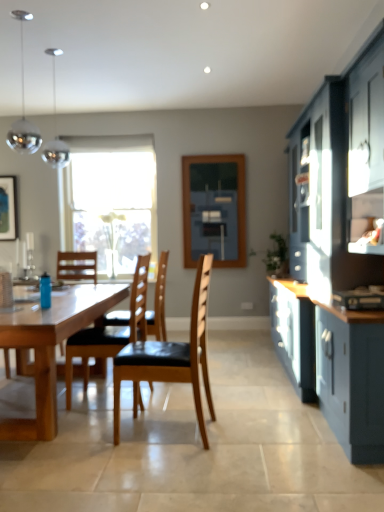
Question: From the image's perspective, relative to satin chrome pendant lights at upper left, is transparent glass window at center above or below?

Choices:
 (A) above
 (B) below

Answer: (B)

Question: From a real-world perspective, relative to satin chrome pendant lights at upper left, is transparent glass window at center vertically above or below?

Choices:
 (A) below
 (B) above

Answer: (A)

Question: Which object is positioned farthest from the wooden chair with black seat cushion at center, acting as the 2th chair starting from the front?

Choices:
 (A) brown leather chair at center, which is the first chair in front-to-back order
 (B) blue matte water bottle at table left
 (C) transparent glass window at center
 (D) wooden chair with black seat cushion at center, the 1th chair from the back
 (E) white plastic power outlet at center

Answer: (E)

Question: Which is nearer to the natural wood table at center?

Choices:
 (A) blue matte water bottle at table left
 (B) blue matte window screen at center
 (C) brown leather chair at center, which is the first chair in front-to-back order
 (D) matte black picture frame at upper left
 (E) wooden chair with black seat cushion at center, which is the third chair in front-to-back order

Answer: (A)